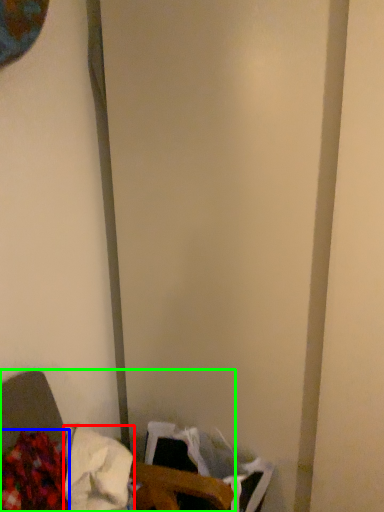
Question: Estimate the real-world distances between objects in this image. Which object is farther from waste (highlighted by a red box), waste (highlighted by a blue box) or furniture (highlighted by a green box)?

Choices:
 (A) waste
 (B) furniture

Answer: (A)